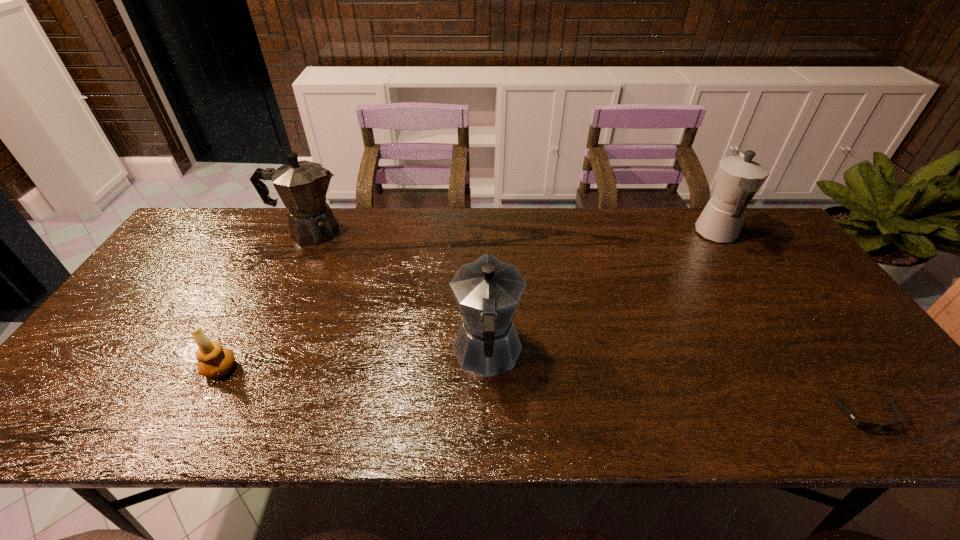
What are the coordinates of `the rightmost coffeepot` in the screenshot? It's located at (739, 177).

Locate an element on the screen. This screenshot has height=540, width=960. the leftmost coffeepot is located at coordinates (302, 186).

This screenshot has height=540, width=960. I want to click on the third object from right to left, so click(x=487, y=291).

This screenshot has width=960, height=540. In order to click on the nearest coffeepot in this screenshot , I will do `click(487, 291)`.

The height and width of the screenshot is (540, 960). What are the coordinates of `the fourth tallest object` in the screenshot? It's located at (214, 361).

Image resolution: width=960 pixels, height=540 pixels. I want to click on the shortest object, so [862, 425].

In order to click on vacant area situated 0.390m on the front of the rightmost coffeepot in this screenshot , I will do `click(799, 361)`.

The image size is (960, 540). What are the coordinates of `vacant area situated on the pouring side of the leftmost coffeepot` in the screenshot? It's located at (460, 232).

The height and width of the screenshot is (540, 960). What are the coordinates of `vacant space located at the spout of the third object from right to left` in the screenshot? It's located at (486, 267).

Image resolution: width=960 pixels, height=540 pixels. What are the coordinates of `free point located at the spout of the third object from right to left` in the screenshot? It's located at (486, 238).